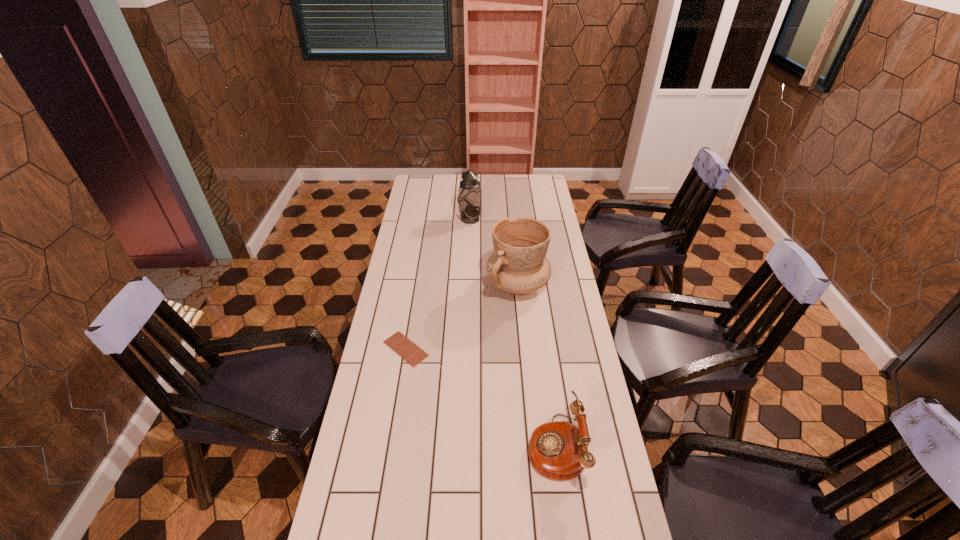
I want to click on oil lamp, so click(x=469, y=199).

Where is `the farthest object`? The height and width of the screenshot is (540, 960). the farthest object is located at coordinates (469, 199).

Where is `pottery`? pottery is located at coordinates (518, 265).

Locate an element on the screen. the second tallest object is located at coordinates (518, 265).

The height and width of the screenshot is (540, 960). I want to click on telephone, so click(558, 450).

You are a GUI agent. You are given a task and a screenshot of the screen. Output one action in this format:
    pyautogui.click(x=<x>, y=<y>)
    Task: Click on the nearest object
    This screenshot has height=540, width=960.
    Given the screenshot: What is the action you would take?
    pyautogui.click(x=558, y=450)

Find the location of `the second nearest object`. the second nearest object is located at coordinates (410, 352).

Find the location of `chocolate bar`. chocolate bar is located at coordinates (410, 352).

Locate an element on the screen. The image size is (960, 540). vacant space located on the right of the tallest object is located at coordinates (548, 219).

The image size is (960, 540). What are the coordinates of `vacant space situated 0.210m on the left of the second farthest object` in the screenshot? It's located at (435, 285).